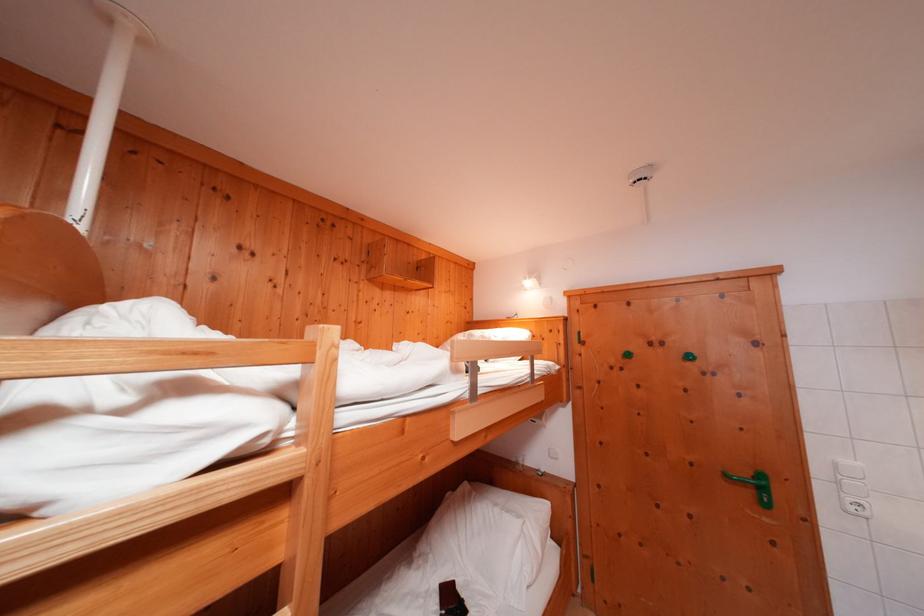
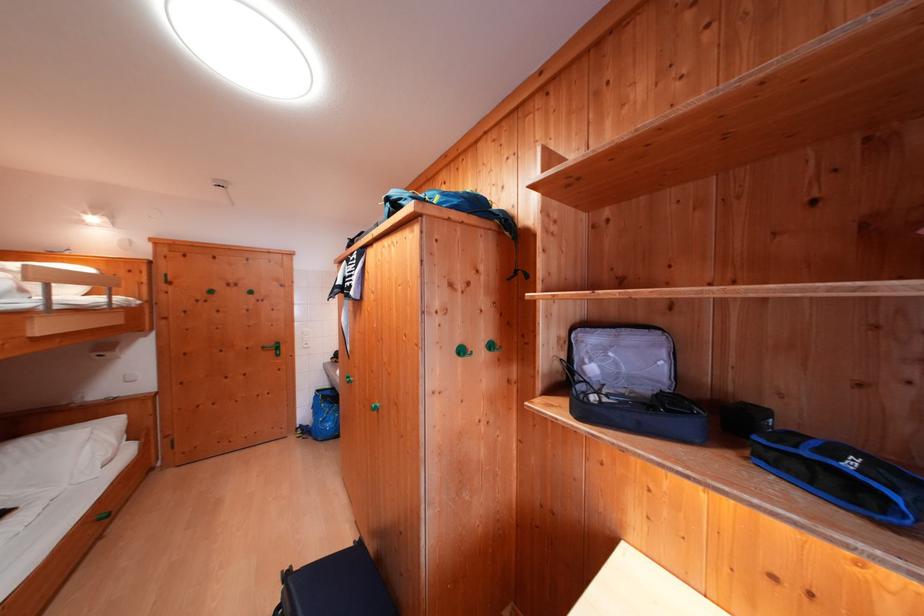
The point at (529,525) is marked in the first image. Where is the corresponding point in the second image?

(96, 434)